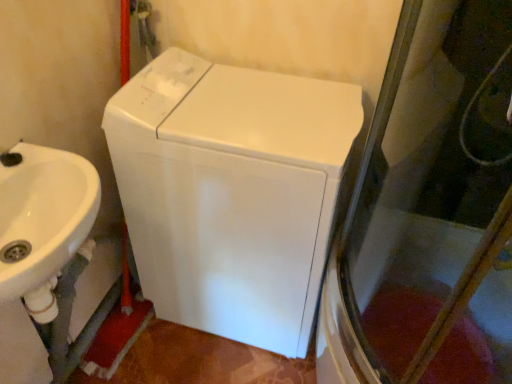
Question: Relative to white glossy washing machine at center, is white glossy sink at left in front or behind?

Choices:
 (A) front
 (B) behind

Answer: (A)

Question: Would you say white glossy sink at left is inside or outside white glossy washing machine at center?

Choices:
 (A) outside
 (B) inside

Answer: (A)

Question: In terms of height, does white glossy sink at left look taller or shorter compared to white glossy washing machine at center?

Choices:
 (A) short
 (B) tall

Answer: (A)

Question: Is point (311, 226) closer or farther from the camera than point (25, 286)?

Choices:
 (A) closer
 (B) farther

Answer: (B)

Question: Relative to white glossy sink at left, is white glossy washing machine at center in front or behind?

Choices:
 (A) behind
 (B) front

Answer: (A)

Question: Is white glossy washing machine at center inside or outside of white glossy sink at left?

Choices:
 (A) outside
 (B) inside

Answer: (A)

Question: In terms of height, does white glossy washing machine at center look taller or shorter compared to white glossy sink at left?

Choices:
 (A) short
 (B) tall

Answer: (B)